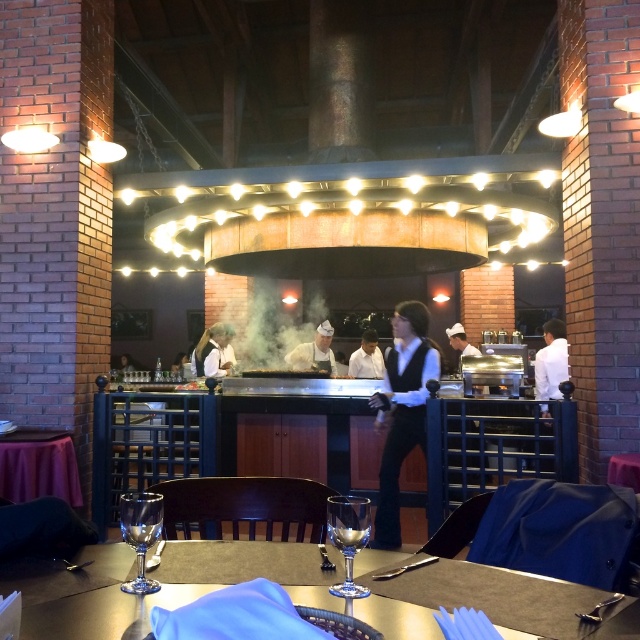
Who is lower down, smoketransparentsteam at center or white shirt at center?

Positioned lower is white shirt at center.

Is point (218, 310) positioned behind point (358, 364)?

Yes, it is.

Where is `smoketransparentsteam at center`? This screenshot has height=640, width=640. smoketransparentsteam at center is located at coordinates (266, 321).

Based on the photo, can you confirm if matte black vest at center is taller than smoketransparentsteam at center?

Yes.

Who is lower down, matte black vest at center or smoketransparentsteam at center?

matte black vest at center is lower down.

Find the location of a particular element. This screenshot has height=640, width=640. matte black vest at center is located at coordinates (403, 410).

Locate an element on the screen. Image resolution: width=640 pixels, height=640 pixels. matte black vest at center is located at coordinates (403, 410).

What do you see at coordinates (140, 532) in the screenshot? The image size is (640, 640). I see `clear glass wine glass at lower left` at bounding box center [140, 532].

Who is higher up, clear glass wine glass at lower left or white glossy chef hat at center?

clear glass wine glass at lower left is above.

Is point (131, 493) farther from camera compared to point (332, 336)?

No.

Where is `clear glass wine glass at lower left`? This screenshot has width=640, height=640. clear glass wine glass at lower left is located at coordinates (140, 532).